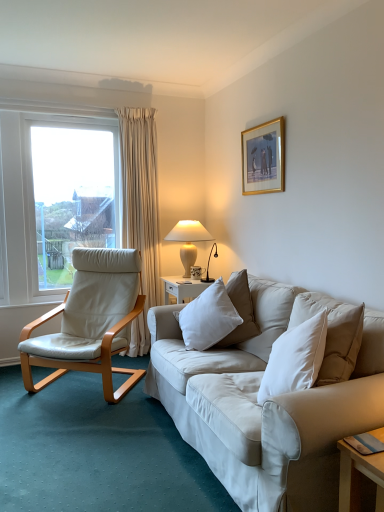
Based on the photo, in order to face white ceramic table lamp at upper right, should I rotate leftwards or rightwards?

Turn left approximately 0.428 degrees to face it.

You are a GUI agent. You are given a task and a screenshot of the screen. Output one action in this format:
    pyautogui.click(x=<x>, y=<y>)
    Task: Click on the white ceramic table lamp at upper right
    This screenshot has height=512, width=384.
    Given the screenshot: What is the action you would take?
    pyautogui.click(x=189, y=232)

This screenshot has width=384, height=512. Describe the element at coordinates (90, 321) in the screenshot. I see `white leather chair at left` at that location.

Find the location of a particular element. white ceramic table lamp at upper right is located at coordinates (189, 232).

Can you confirm if white soft pillow at center is positioned to the right of gold/glossy picture frame at upper center?

Incorrect, white soft pillow at center is not on the right side of gold/glossy picture frame at upper center.

Is white soft pillow at center located outside gold/glossy picture frame at upper center?

white soft pillow at center is positioned outside gold/glossy picture frame at upper center.

Would you consider white soft pillow at center to be distant from gold/glossy picture frame at upper center?

No, there isn't a large distance between white soft pillow at center and gold/glossy picture frame at upper center.

Who is smaller, white soft pillow at center or gold/glossy picture frame at upper center?

gold/glossy picture frame at upper center is smaller.

Which is more to the right, white soft pillow at center or white leather chair at left?

white soft pillow at center.

Locate an element on the screen. pillow on the right of white leather chair at left is located at coordinates (208, 318).

Is white leather chair at left completely or partially inside white soft pillow at center?

No, white soft pillow at center does not contain white leather chair at left.

Is white soft pillow at center oriented towards white leather chair at left?

No.

Could you tell me if gold/glossy picture frame at upper center is turned towards white soft pillow at center?

No, gold/glossy picture frame at upper center does not turn towards white soft pillow at center.

Is gold/glossy picture frame at upper center not within white soft pillow at center?

Yes, gold/glossy picture frame at upper center is located beyond the bounds of white soft pillow at center.

In the image, there is a gold/glossy picture frame at upper center. Identify the location of pillow below it (from the image's perspective). (208, 318).

What's the angular difference between gold/glossy picture frame at upper center and white soft pillow at center's facing directions?

26 degrees.

Is white ceramic table lamp at upper right in front of or behind white soft pillow at center in the image?

In the image, white ceramic table lamp at upper right appears behind white soft pillow at center.

From a real-world perspective, is white ceramic table lamp at upper right positioned above or below white soft pillow at center?

In terms of real-world spatial position, white ceramic table lamp at upper right is above white soft pillow at center.

Considering the relative sizes of white ceramic table lamp at upper right and white soft pillow at center in the image provided, is white ceramic table lamp at upper right taller than white soft pillow at center?

Yes.

Are white ceramic table lamp at upper right and white soft pillow at center far apart?

Yes.

Who is taller, white leather chair at left or white soft pillow at center?

With more height is white leather chair at left.

Is white soft pillow at center located within white leather chair at left?

Actually, white soft pillow at center is outside white leather chair at left.

Does white leather chair at left turn towards white soft pillow at center?

No, white leather chair at left is not aimed at white soft pillow at center.

Which is behind, white leather chair at left or white soft pillow at center?

Positioned behind is white leather chair at left.

Are white ceramic table lamp at upper right and white leather chair at left far apart?

No, white ceramic table lamp at upper right is not far from white leather chair at left.

I want to click on table lamp above the white leather chair at left (from a real-world perspective), so click(189, 232).

From the picture: Is white ceramic table lamp at upper right smaller than white leather chair at left?

Yes.

Consider the image. From their relative heights in the image, would you say white soft pillow at center is taller or shorter than white ceramic table lamp at upper right?

In the image, white soft pillow at center appears to be shorter than white ceramic table lamp at upper right.

How distant is white soft pillow at center from white ceramic table lamp at upper right?

3.30 feet.

Considering the sizes of objects white soft pillow at center and white ceramic table lamp at upper right in the image provided, who is thinner, white soft pillow at center or white ceramic table lamp at upper right?

Thinner between the two is white ceramic table lamp at upper right.

From the image's perspective, relative to white ceramic table lamp at upper right, is white soft pillow at center above or below?

From the image's perspective, white soft pillow at center appears below white ceramic table lamp at upper right.

In order to click on picture frame behind the white soft pillow at center in this screenshot , I will do 263,158.

Locate an element on the screen. Image resolution: width=384 pixels, height=512 pixels. pillow above the white leather chair at left (from the image's perspective) is located at coordinates (208, 318).

From the image, which object appears to be farther from gold/glossy picture frame at upper center, white ceramic table lamp at upper right or white soft pillow at center?

white soft pillow at center lies further to gold/glossy picture frame at upper center than the other object.

Estimate the real-world distances between objects in this image. Which object is closer to white ceramic table lamp at upper right, white leather chair at left or white soft pillow at center?

Among the two, white leather chair at left is located nearer to white ceramic table lamp at upper right.

Estimate the real-world distances between objects in this image. Which object is further from white soft pillow at center, white leather chair at left or gold/glossy picture frame at upper center?

gold/glossy picture frame at upper center is positioned further to the anchor white soft pillow at center.

From the image, which object appears to be farther from white soft pillow at center, gold/glossy picture frame at upper center or white leather chair at left?

gold/glossy picture frame at upper center lies further to white soft pillow at center than the other object.

From the image, which object appears to be nearer to white leather chair at left, white ceramic table lamp at upper right or white soft pillow at center?

The object closer to white leather chair at left is white soft pillow at center.

When comparing their distances from gold/glossy picture frame at upper center, does white leather chair at left or white ceramic table lamp at upper right seem further?

white leather chair at left is positioned further to the anchor gold/glossy picture frame at upper center.

When comparing their distances from white leather chair at left, does gold/glossy picture frame at upper center or white soft pillow at center seem closer?

Among the two, white soft pillow at center is located nearer to white leather chair at left.

From the image, which object appears to be nearer to white soft pillow at center, white leather chair at left or white ceramic table lamp at upper right?

white leather chair at left lies closer to white soft pillow at center than the other object.

I want to click on table lamp located between white leather chair at left and gold/glossy picture frame at upper center in the left-right direction, so click(189, 232).

This screenshot has height=512, width=384. Find the location of `pillow between white leather chair at left and gold/glossy picture frame at upper center in the horizontal direction`. pillow between white leather chair at left and gold/glossy picture frame at upper center in the horizontal direction is located at coordinates (208, 318).

Locate an element on the screen. table lamp between gold/glossy picture frame at upper center and white soft pillow at center vertically is located at coordinates (189, 232).

Where is `chair located between white soft pillow at center and white ceramic table lamp at upper right in the depth direction`? chair located between white soft pillow at center and white ceramic table lamp at upper right in the depth direction is located at coordinates click(90, 321).